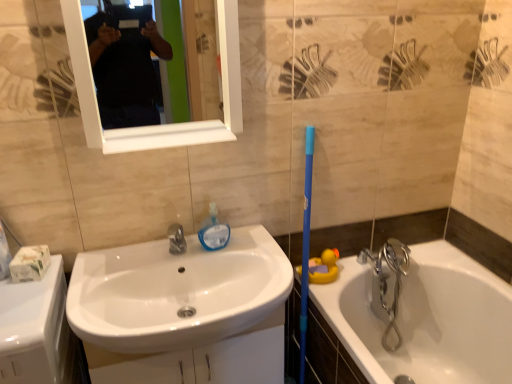
Question: Is white glossy sink at center situated inside white glossy counter top at lower left or outside?

Choices:
 (A) inside
 (B) outside

Answer: (B)

Question: Would you say white glossy sink at center is to the left or to the right of white glossy counter top at lower left in the picture?

Choices:
 (A) left
 (B) right

Answer: (B)

Question: Which object is positioned closest to the white glossy sink at center?

Choices:
 (A) white glossy mirror at upper center
 (B) yellow rubber duck at lower right
 (C) chrome metallic faucet at right
 (D) translucent plastic soap dispenser at center
 (E) white glossy bathtub at right

Answer: (D)

Question: Which of these objects is positioned farthest from the white glossy counter top at lower left?

Choices:
 (A) white glossy sink at center
 (B) white glossy mirror at upper center
 (C) translucent plastic soap dispenser at center
 (D) chrome metallic faucet at right
 (E) yellow rubber duck at lower right

Answer: (B)